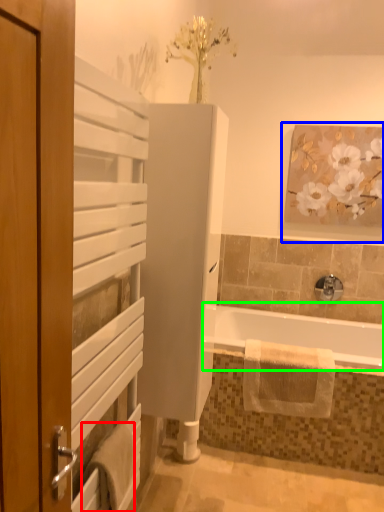
Question: Which object is the farthest from bath towel (highlighted by a red box)? Choose among these: picture frame (highlighted by a blue box) or bathtub (highlighted by a green box).

Choices:
 (A) picture frame
 (B) bathtub

Answer: (A)